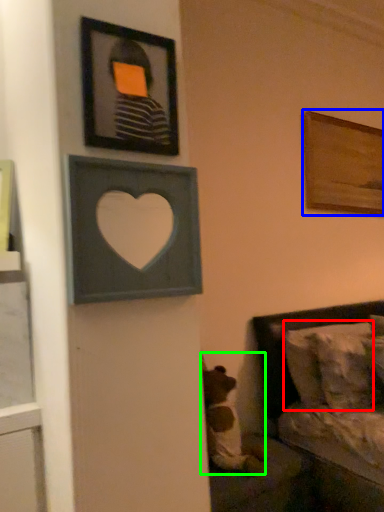
Question: Considering the real-world distances, which object is closest to pillow (highlighted by a red box)? picture frame (highlighted by a blue box) or animal (highlighted by a green box).

Choices:
 (A) picture frame
 (B) animal

Answer: (B)